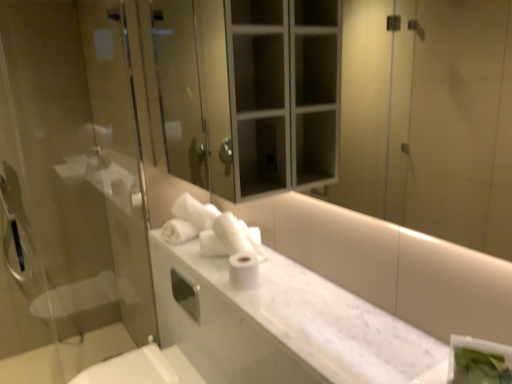
Question: From the image's perspective, relative to white matte toilet paper at center, is white glossy mirror at upper center above or below?

Choices:
 (A) below
 (B) above

Answer: (B)

Question: Does point (442, 115) appear closer or farther from the camera than point (242, 279)?

Choices:
 (A) farther
 (B) closer

Answer: (A)

Question: Which of these objects is positioned farthest from the white marble counter top at center?

Choices:
 (A) transparent glass screen door at left
 (B) white matte toilet paper at center
 (C) white glossy mirror at upper center

Answer: (C)

Question: Which object is positioned farthest from the white matte toilet paper at center?

Choices:
 (A) transparent glass screen door at left
 (B) white glossy mirror at upper center
 (C) white marble counter top at center

Answer: (B)